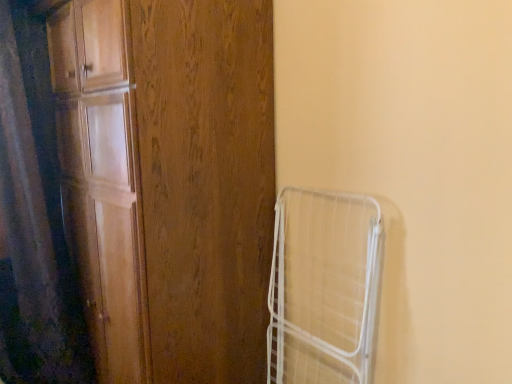
I want to click on white wire cage at right, so click(324, 288).

What is the approximate width of white wire cage at right?

The width of white wire cage at right is 5.97 inches.

Find the location of `wooden door at left`. wooden door at left is located at coordinates (169, 182).

Does point (88, 65) come in front of point (4, 46)?

Yes, point (88, 65) is in front of point (4, 46).

Is wooden door at left situated inside black matte shower curtain at left or outside?

wooden door at left cannot be found inside black matte shower curtain at left.

Considering the sizes of wooden door at left and black matte shower curtain at left in the image, is wooden door at left taller or shorter than black matte shower curtain at left?

Clearly, wooden door at left is taller compared to black matte shower curtain at left.

Is wooden door at left facing towards black matte shower curtain at left?

Yes.

Are white wire cage at right and wooden door at left located far from each other?

white wire cage at right is near wooden door at left, not far away.

Does white wire cage at right have a greater height compared to wooden door at left?

In fact, white wire cage at right may be shorter than wooden door at left.

Is point (371, 271) positioned before point (114, 304)?

Yes, it is in front of point (114, 304).

In terms of height, does black matte shower curtain at left look taller or shorter compared to white wire cage at right?

In the image, black matte shower curtain at left appears to be taller than white wire cage at right.

Is black matte shower curtain at left wider than white wire cage at right?

Correct, the width of black matte shower curtain at left exceeds that of white wire cage at right.

From a real-world perspective, relative to white wire cage at right, is black matte shower curtain at left vertically above or below?

In terms of real-world spatial position, black matte shower curtain at left is above white wire cage at right.

Are black matte shower curtain at left and white wire cage at right beside each other?

black matte shower curtain at left and white wire cage at right are not in contact.

In terms of width, does black matte shower curtain at left look wider or thinner when compared to wooden door at left?

Clearly, black matte shower curtain at left has less width compared to wooden door at left.

From a real-world perspective, is black matte shower curtain at left physically located above or below wooden door at left?

In terms of real-world spatial position, black matte shower curtain at left is above wooden door at left.

In the scene shown: Is wooden door at left located within black matte shower curtain at left?

No, wooden door at left is located outside of black matte shower curtain at left.

Is white wire cage at right surrounding black matte shower curtain at left?

No, black matte shower curtain at left is not inside white wire cage at right.

Is white wire cage at right directly adjacent to black matte shower curtain at left?

There is a gap between white wire cage at right and black matte shower curtain at left.

Is white wire cage at right to the left or to the right of black matte shower curtain at left in the image?

white wire cage at right is positioned on black matte shower curtain at left's right side.

In terms of height, does wooden door at left look taller or shorter compared to white wire cage at right?

In the image, wooden door at left appears to be taller than white wire cage at right.

Is point (136, 196) positioned after point (269, 288)?

No, it is not.

Is the position of wooden door at left less distant than that of white wire cage at right?

Yes, wooden door at left is in front of white wire cage at right.

Considering the relative positions of wooden door at left and white wire cage at right in the image provided, is wooden door at left to the left of white wire cage at right from the viewer's perspective?

Yes.

Find the location of a particular element. The image size is (512, 384). door below the black matte shower curtain at left (from a real-world perspective) is located at coordinates (169, 182).

Identify the location of door that appears in front of the white wire cage at right. This screenshot has width=512, height=384. (169, 182).

Looking at the image, which one is located further to wooden door at left, white wire cage at right or black matte shower curtain at left?

black matte shower curtain at left is positioned further to the anchor wooden door at left.

Which object lies further to the anchor point black matte shower curtain at left, white wire cage at right or wooden door at left?

white wire cage at right lies further to black matte shower curtain at left than the other object.

When comparing their distances from wooden door at left, does black matte shower curtain at left or white wire cage at right seem closer?

white wire cage at right.

Looking at the image, which one is located further to white wire cage at right, black matte shower curtain at left or wooden door at left?

black matte shower curtain at left is further to white wire cage at right.

Based on their spatial positions, is wooden door at left or black matte shower curtain at left further from white wire cage at right?

black matte shower curtain at left is positioned further to the anchor white wire cage at right.

Based on their spatial positions, is wooden door at left or white wire cage at right further from black matte shower curtain at left?

white wire cage at right.

I want to click on door between black matte shower curtain at left and white wire cage at right, so point(169,182).